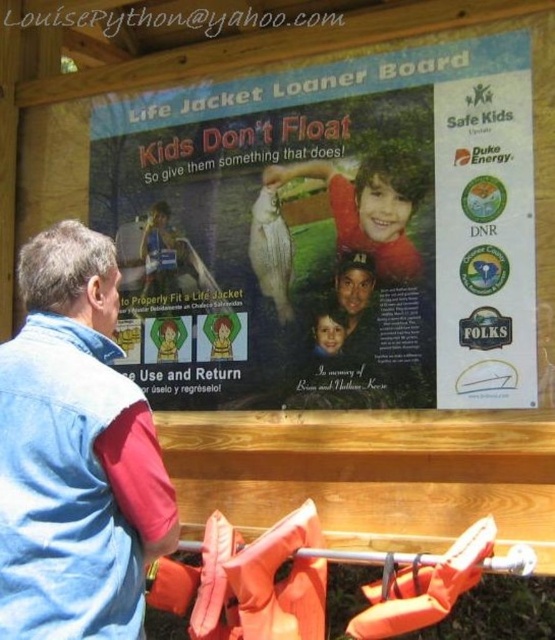
Is matte paper poster at center above blue denim jacket at left?

Yes.

Can you confirm if matte paper poster at center is thinner than blue denim jacket at left?

Incorrect, matte paper poster at center's width is not less than blue denim jacket at left's.

Where is `matte paper poster at center`? matte paper poster at center is located at coordinates (329, 232).

Which is above, matte paper poster at center or smooth red shirt at center?

Positioned higher is smooth red shirt at center.

In the scene shown: Is matte paper poster at center taller than smooth red shirt at center?

Correct, matte paper poster at center is much taller as smooth red shirt at center.

Where is `matte paper poster at center`? The height and width of the screenshot is (640, 555). matte paper poster at center is located at coordinates (329, 232).

Describe the element at coordinates (74, 452) in the screenshot. I see `blue denim jacket at left` at that location.

Which of these two, blue denim jacket at left or smooth red shirt at center, stands shorter?

smooth red shirt at center

Where is `blue denim jacket at left`? blue denim jacket at left is located at coordinates (74, 452).

Locate an element on the screen. The image size is (555, 640). blue denim jacket at left is located at coordinates (74, 452).